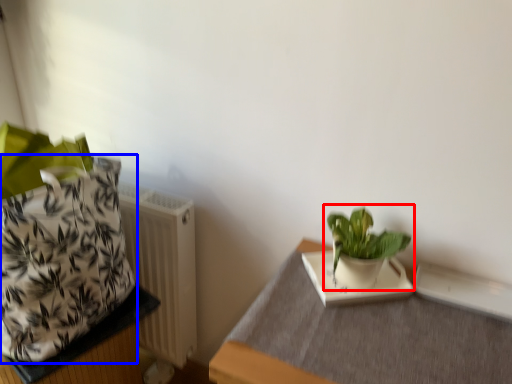
Question: Which object appears farthest to the camera in this image, houseplant (highlighted by a red box) or flowerpot (highlighted by a blue box)?

Choices:
 (A) houseplant
 (B) flowerpot

Answer: (A)